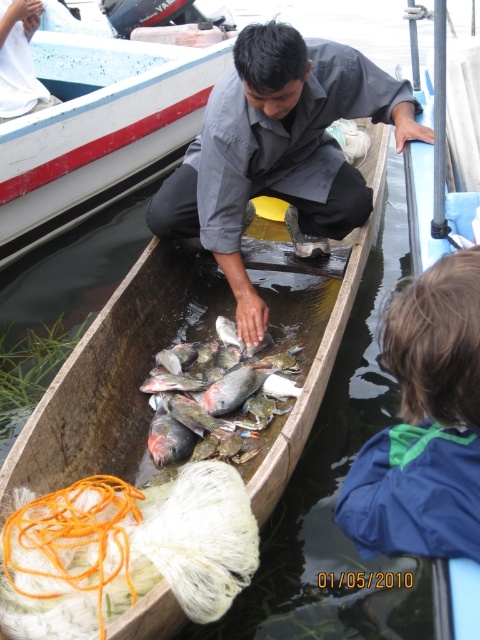
You are a delivery person who needs to place a blue fleece jacket at lower right onto a shelf that is 1.5 meters away from you. Can you reach the shelf without moving your position?

The blue fleece jacket at lower right is 1.37 meters away from camera, so yes, the delivery person can reach the shelf since it is within the 1.5 meters distance.